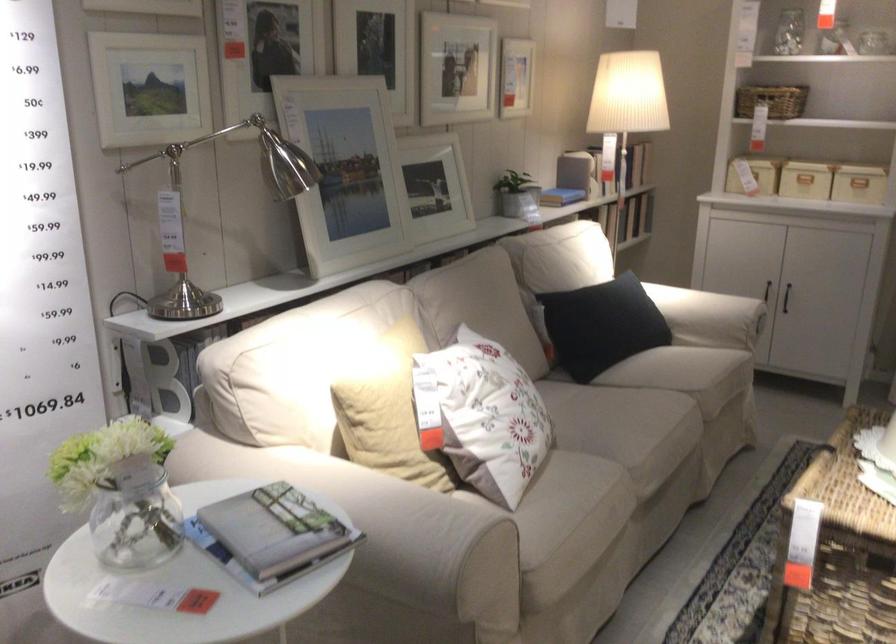
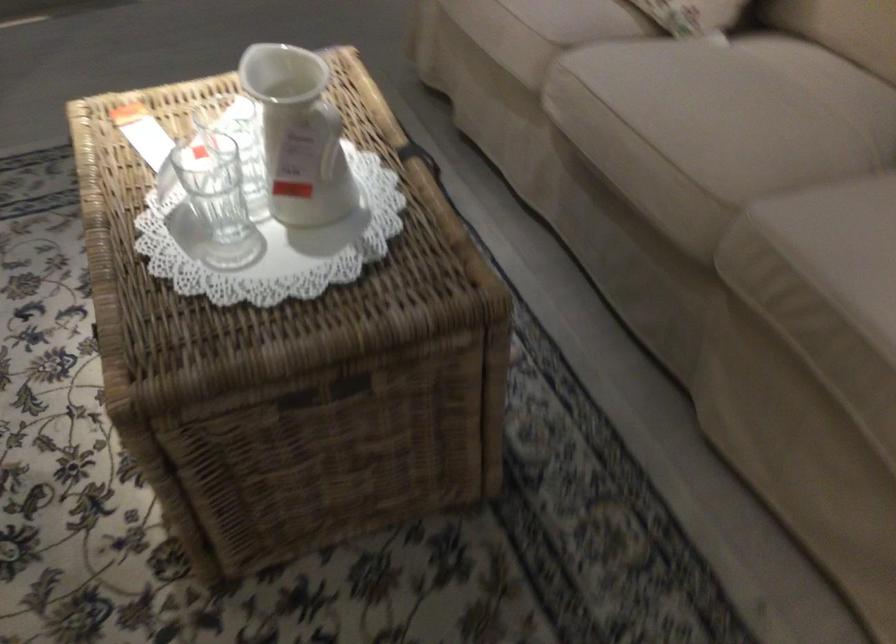
Question: I am providing you with two images of the same scene from different viewpoints. Which of the following objects are not visible in image2?

Choices:
 (A) wicker storage basket
 (B) sofa sitting surface
 (C) woven laundry basket
 (D) clear glass

Answer: (A)